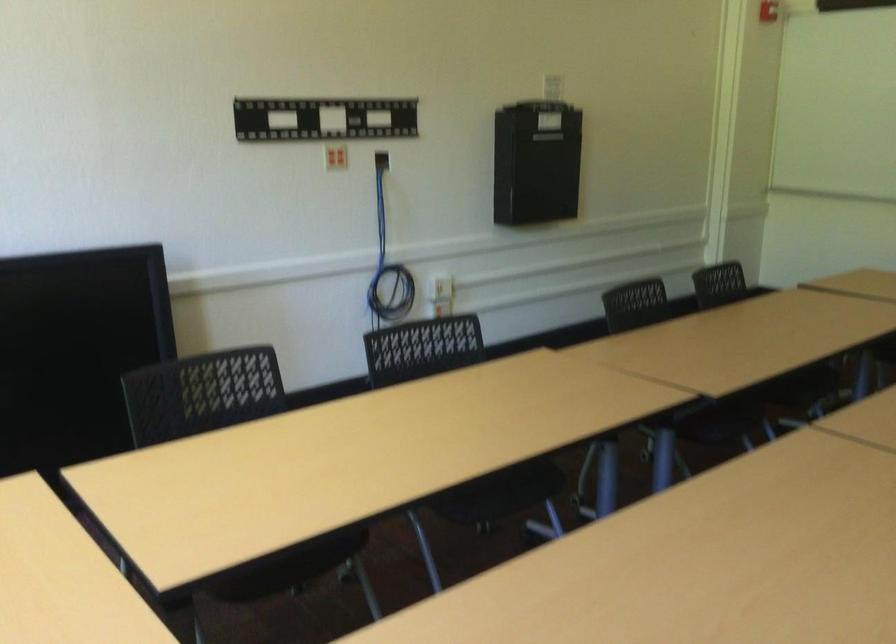
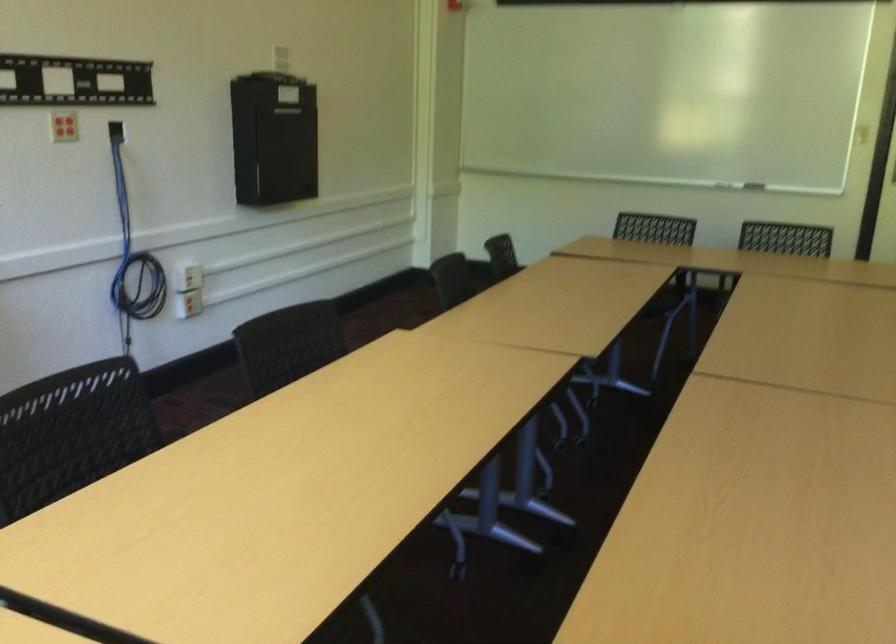
The point at (204, 395) is marked in the first image. Where is the corresponding point in the second image?

(71, 433)